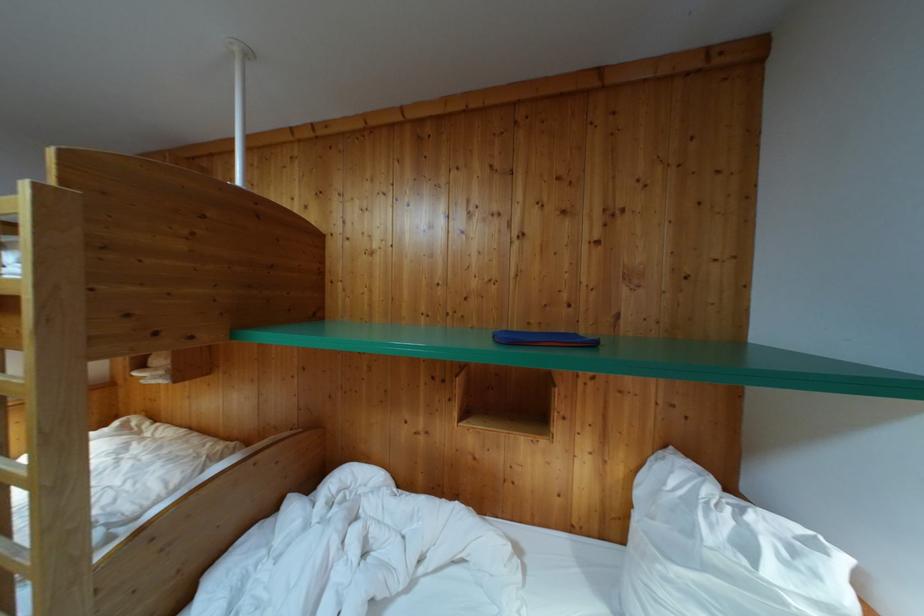
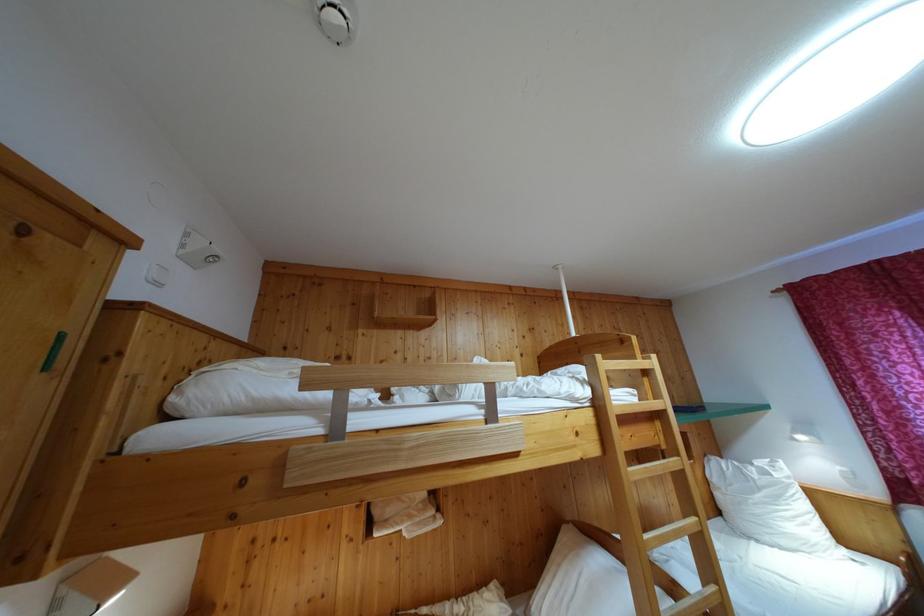
Where in the second image is the point corresponding to (746,517) from the first image?

(755, 471)